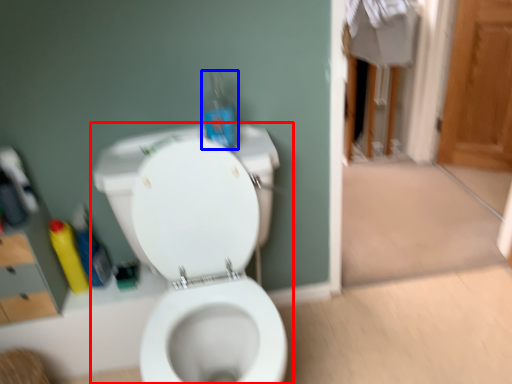
Question: Which object appears farthest to the camera in this image, toilet (highlighted by a red box) or bottle (highlighted by a blue box)?

Choices:
 (A) toilet
 (B) bottle

Answer: (B)